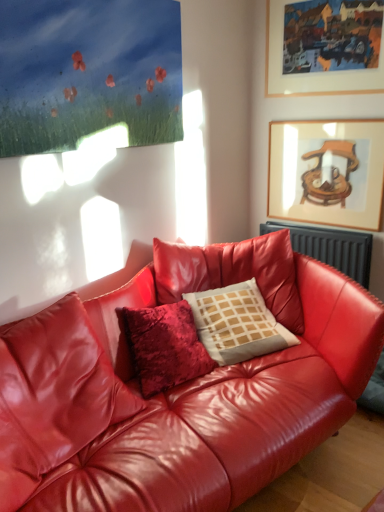
Question: From a real-world perspective, is black metallic radiator at upper right physically above shiny red leather couch at center?

Choices:
 (A) no
 (B) yes

Answer: (B)

Question: Is black metallic radiator at upper right facing towards shiny red leather couch at center?

Choices:
 (A) no
 (B) yes

Answer: (B)

Question: From the image's perspective, is black metallic radiator at upper right on top of shiny red leather couch at center?

Choices:
 (A) yes
 (B) no

Answer: (A)

Question: Can you confirm if black metallic radiator at upper right is wider than shiny red leather couch at center?

Choices:
 (A) yes
 (B) no

Answer: (B)

Question: Can you confirm if black metallic radiator at upper right is shorter than shiny red leather couch at center?

Choices:
 (A) no
 (B) yes

Answer: (B)

Question: Would you say black metallic radiator at upper right is a long distance from shiny red leather couch at center?

Choices:
 (A) no
 (B) yes

Answer: (A)

Question: Considering the relative positions of shiny red leather couch at center and wooden-framed painting at upper right, placed as the second picture frame when sorted from bottom to top, in the image provided, is shiny red leather couch at center to the left of wooden-framed painting at upper right, placed as the second picture frame when sorted from bottom to top, from the viewer's perspective?

Choices:
 (A) yes
 (B) no

Answer: (A)

Question: Considering the relative sizes of shiny red leather couch at center and wooden-framed painting at upper right, placed as the second picture frame when sorted from bottom to top, in the image provided, is shiny red leather couch at center shorter than wooden-framed painting at upper right, placed as the second picture frame when sorted from bottom to top,?

Choices:
 (A) no
 (B) yes

Answer: (A)

Question: From a real-world perspective, is shiny red leather couch at center positioned under wooden-framed painting at upper right, the 1th picture frame when ordered from top to bottom, based on gravity?

Choices:
 (A) yes
 (B) no

Answer: (A)

Question: From the image's perspective, is shiny red leather couch at center over wooden-framed painting at upper right, placed as the second picture frame when sorted from bottom to top?

Choices:
 (A) yes
 (B) no

Answer: (B)

Question: Does shiny red leather couch at center have a smaller size compared to wooden-framed painting at upper right, placed as the second picture frame when sorted from bottom to top?

Choices:
 (A) no
 (B) yes

Answer: (A)

Question: Is shiny red leather couch at center positioned before wooden-framed painting at upper right, placed as the second picture frame when sorted from bottom to top?

Choices:
 (A) yes
 (B) no

Answer: (A)

Question: Does black metallic radiator at upper right have a smaller size compared to white textured pillow at center?

Choices:
 (A) no
 (B) yes

Answer: (B)